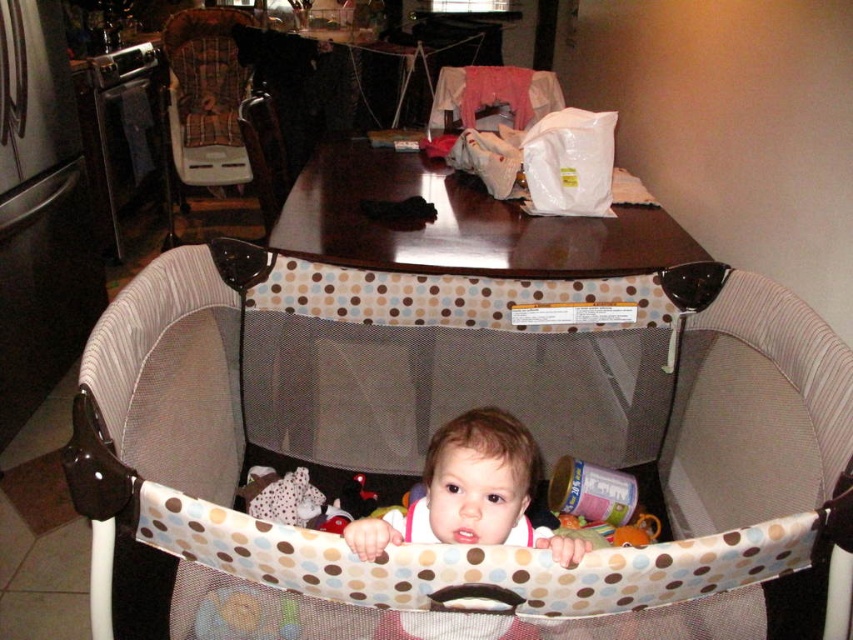
Question: Does plaid fabric highchair at left appear under smooth beige baby playpen at center?

Choices:
 (A) no
 (B) yes

Answer: (A)

Question: Which of the following is the farthest from the observer?

Choices:
 (A) plaid fabric highchair at left
 (B) smooth beige baby playpen at center
 (C) polka dot fabric playpen at center

Answer: (A)

Question: Does polka dot fabric playpen at center appear on the right side of wooden chair at center?

Choices:
 (A) no
 (B) yes

Answer: (B)

Question: Which point is farther from the camera taking this photo?

Choices:
 (A) (173, 365)
 (B) (279, 173)
 (C) (461, 413)
 (D) (187, 166)

Answer: (D)

Question: Does polka dot fabric playpen at center have a smaller size compared to smooth beige baby playpen at center?

Choices:
 (A) no
 (B) yes

Answer: (A)

Question: Which of these objects is positioned farthest from the polka dot fabric playpen at center?

Choices:
 (A) plaid fabric highchair at left
 (B) smooth beige baby playpen at center

Answer: (A)